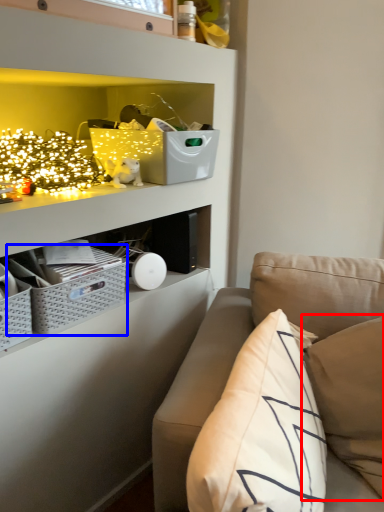
Question: Among these objects, which one is nearest to the camera, pillow (highlighted by a red box) or crate (highlighted by a blue box)?

Choices:
 (A) pillow
 (B) crate

Answer: (A)